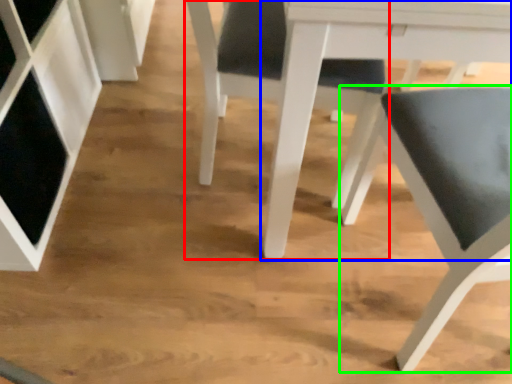
Question: Estimate the real-world distances between objects in this image. Which object is farther from chair (highlighted by a red box), table (highlighted by a blue box) or chair (highlighted by a green box)?

Choices:
 (A) table
 (B) chair

Answer: (B)